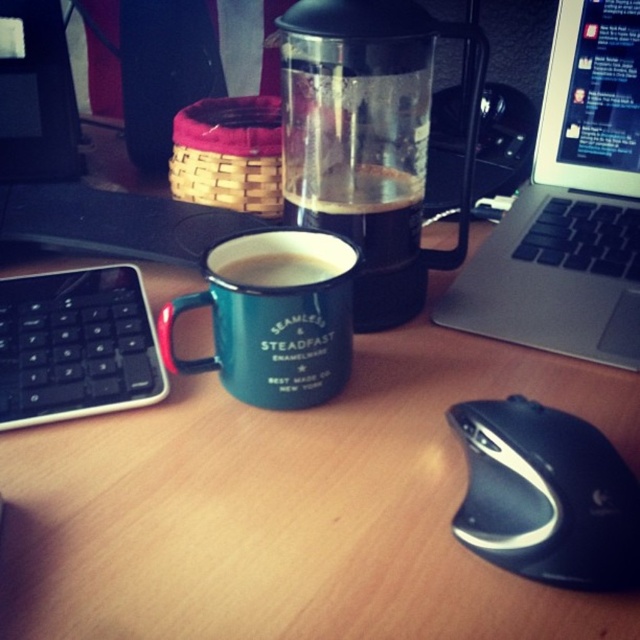
Can you confirm if teal enamel mug at center is thinner than matte enamel mug at center?

Incorrect, teal enamel mug at center's width is not less than matte enamel mug at center's.

Who is positioned more to the right, teal enamel mug at center or matte enamel mug at center?

teal enamel mug at center

Image resolution: width=640 pixels, height=640 pixels. Describe the element at coordinates (273, 317) in the screenshot. I see `teal enamel mug at center` at that location.

The height and width of the screenshot is (640, 640). I want to click on teal enamel mug at center, so click(273, 317).

Can you confirm if silver metallic laptop at upper right is taller than black rubberized mouse at lower right?

Indeed, silver metallic laptop at upper right has a greater height compared to black rubberized mouse at lower right.

Is silver metallic laptop at upper right thinner than black rubberized mouse at lower right?

No.

Is point (509, 291) positioned before point (560, 531)?

That is False.

You are a GUI agent. You are given a task and a screenshot of the screen. Output one action in this format:
    pyautogui.click(x=<x>, y=<y>)
    Task: Click on the silver metallic laptop at upper right
    The height and width of the screenshot is (640, 640).
    Given the screenshot: What is the action you would take?
    pyautogui.click(x=570, y=205)

Is black rubberized mouse at lower right below teal enamel mug at center?

Indeed, black rubberized mouse at lower right is positioned under teal enamel mug at center.

Between black rubberized mouse at lower right and teal enamel mug at center, which one is positioned lower?

black rubberized mouse at lower right

Which is in front, point (470, 432) or point (324, 304)?

Point (470, 432)

Identify the location of black rubberized mouse at lower right. The width and height of the screenshot is (640, 640). (547, 496).